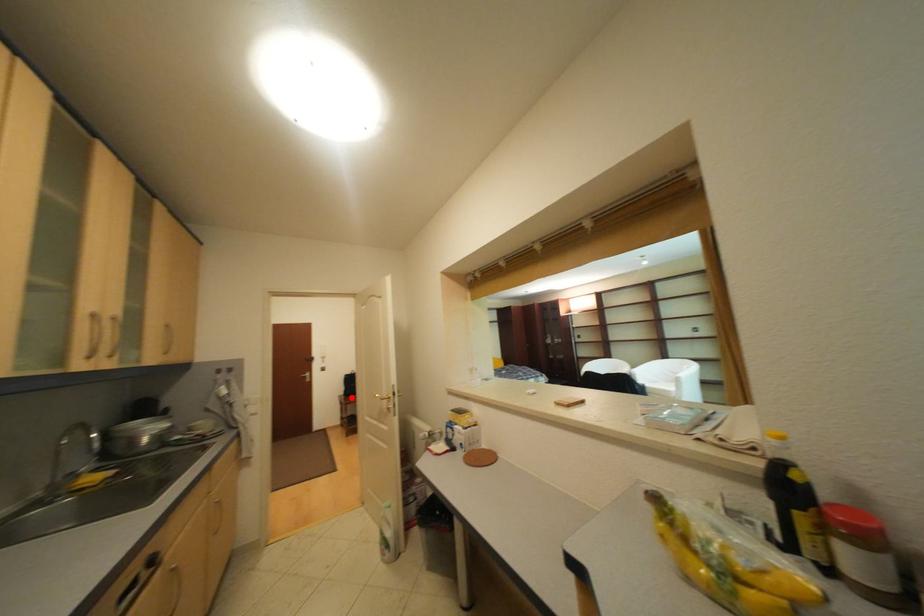
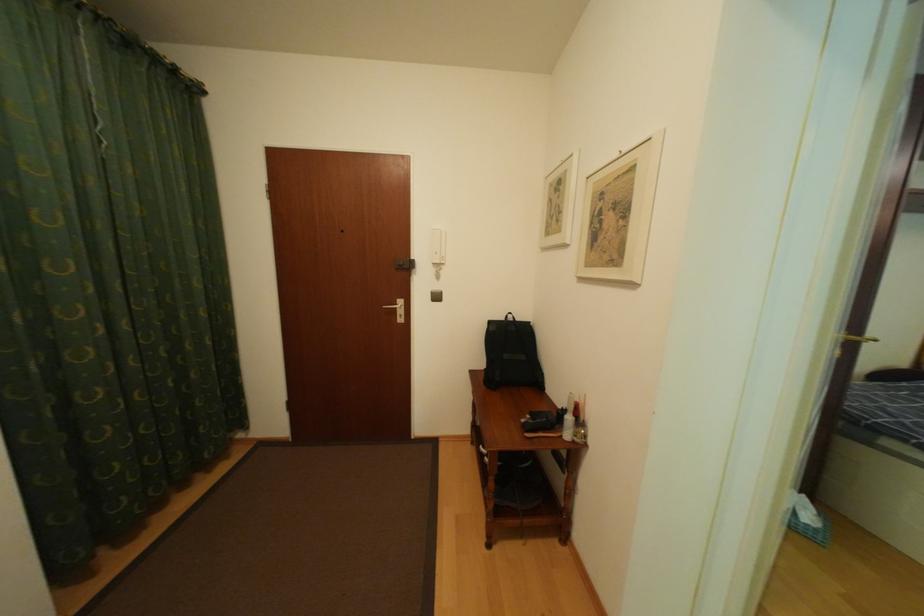
Question: I am providing you with two images of the same scene from different viewpoints. Image1 has a red point marked. In image2, the corresponding 3D location appears at what relative position? Reply with the corresponding letter.

Choices:
 (A) Closer
 (B) Farther

Answer: (A)